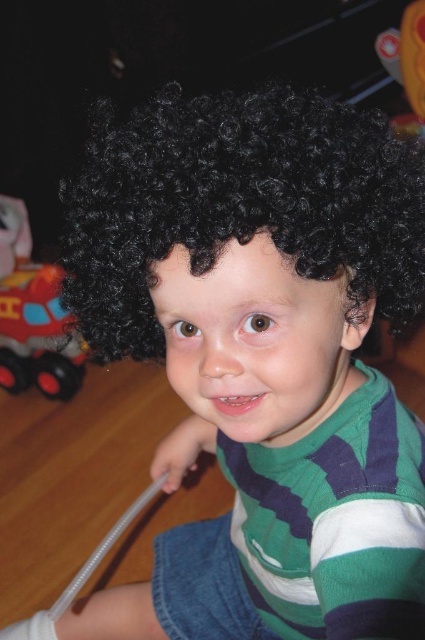
Question: Considering the relative positions of black curly wig at center and rubberized red truck at lower left in the image provided, where is black curly wig at center located with respect to rubberized red truck at lower left?

Choices:
 (A) above
 (B) below

Answer: (B)

Question: Is black curly wig at center below rubberized red truck at lower left?

Choices:
 (A) no
 (B) yes

Answer: (B)

Question: Among these objects, which one is farthest from the camera?

Choices:
 (A) rubberized red truck at lower left
 (B) black curly wig at center

Answer: (A)

Question: In this image, where is black curly wig at center located relative to rubberized red truck at lower left?

Choices:
 (A) left
 (B) right

Answer: (B)